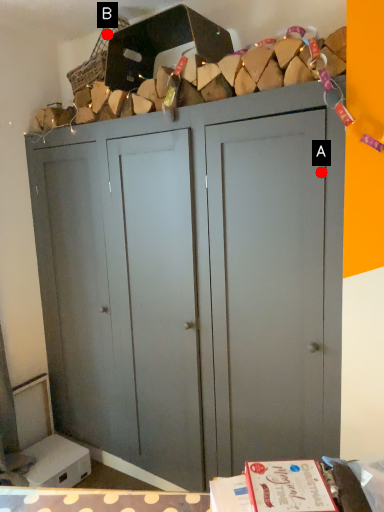
Question: Two points are circled on the image, labeled by A and B beside each circle. Which of the following is the farthest from the observer?

Choices:
 (A) A is further
 (B) B is further

Answer: (B)